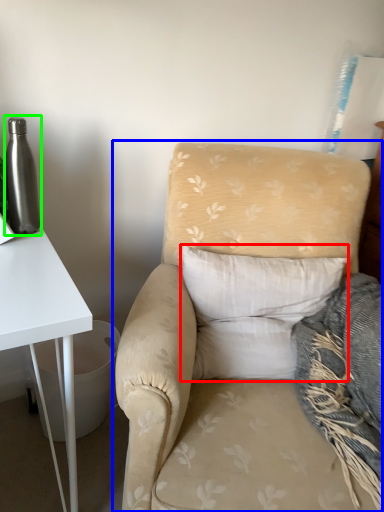
Question: Estimate the real-world distances between objects in this image. Which object is farther from pillow (highlighted by a red box), chair (highlighted by a blue box) or bottle (highlighted by a green box)?

Choices:
 (A) chair
 (B) bottle

Answer: (B)